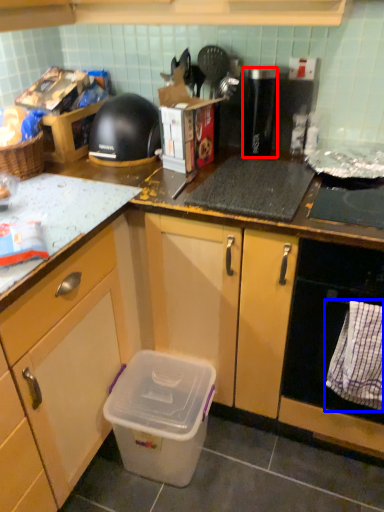
Question: Which of the following is the closest to the observer, appliance (highlighted by a red box) or cloth (highlighted by a blue box)?

Choices:
 (A) appliance
 (B) cloth

Answer: (B)